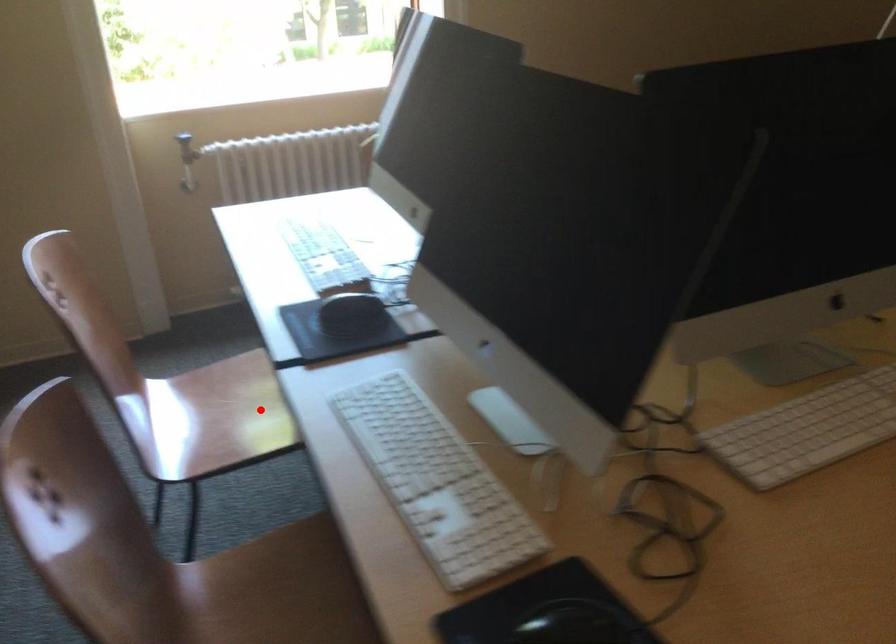
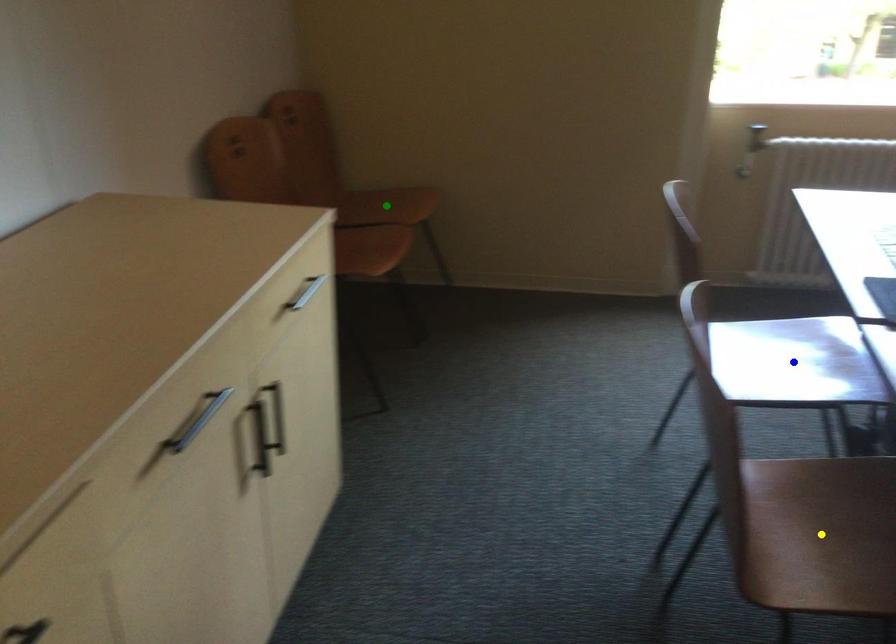
Question: I am providing you with two images of the same scene from different viewpoints. A red point is marked on the first image. You are given multiple points on the second image. Which spot in image 2 lines up with the point in image 1?

Choices:
 (A) green point
 (B) yellow point
 (C) blue point

Answer: (C)